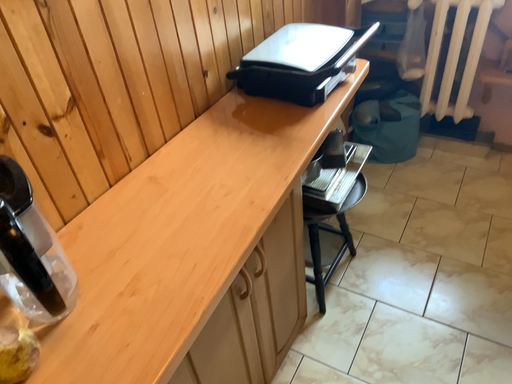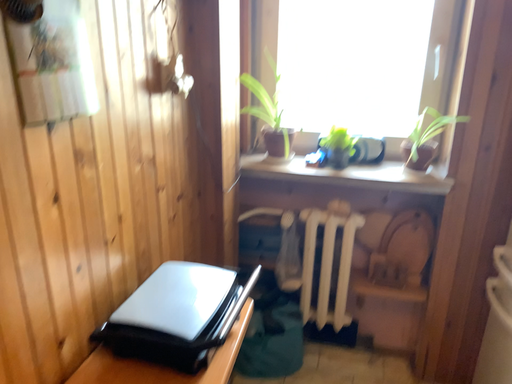
Question: How did the camera likely rotate when shooting the video?

Choices:
 (A) rotated downward
 (B) rotated upward

Answer: (B)